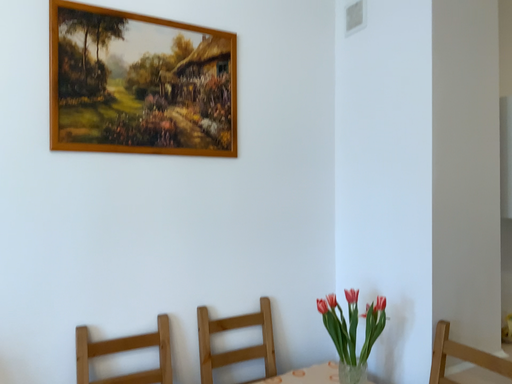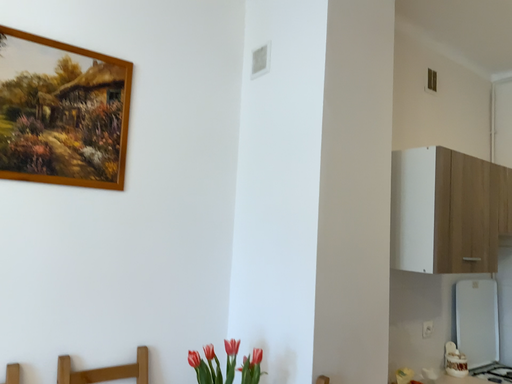
Question: How did the camera likely rotate when shooting the video?

Choices:
 (A) rotated left
 (B) rotated right

Answer: (B)